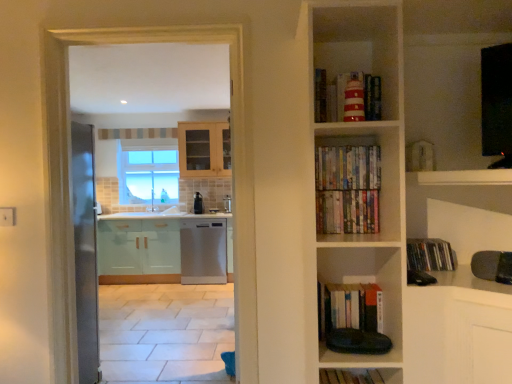
Question: From a real-world perspective, is clear glass window at center physically below striped paper lighthouse at upper center, which is the 6th book in bottom-to-top order?

Choices:
 (A) no
 (B) yes

Answer: (B)

Question: Does clear glass window at center have a lesser width compared to striped paper lighthouse at upper center, the first book when ordered from top to bottom?

Choices:
 (A) no
 (B) yes

Answer: (A)

Question: Does clear glass window at center have a larger size compared to striped paper lighthouse at upper center, which is the 6th book in bottom-to-top order?

Choices:
 (A) yes
 (B) no

Answer: (A)

Question: From the image's perspective, would you say clear glass window at center is shown under striped paper lighthouse at upper center, the first book when ordered from top to bottom?

Choices:
 (A) yes
 (B) no

Answer: (A)

Question: Can you confirm if clear glass window at center is shorter than striped paper lighthouse at upper center, the first book when ordered from top to bottom?

Choices:
 (A) no
 (B) yes

Answer: (A)

Question: From the image's perspective, is clear glass window at center above striped paper lighthouse at upper center, the first book when ordered from top to bottom?

Choices:
 (A) no
 (B) yes

Answer: (A)

Question: Is satin black dishwasher at center at the left side of wooden book at lower center, which ranks as the first book in bottom-to-top order?

Choices:
 (A) no
 (B) yes

Answer: (B)

Question: From the image's perspective, is satin black dishwasher at center above wooden book at lower center, which ranks as the first book in bottom-to-top order?

Choices:
 (A) no
 (B) yes

Answer: (B)

Question: Can you confirm if satin black dishwasher at center is wider than wooden book at lower center, which is the sixth book in top-to-bottom order?

Choices:
 (A) yes
 (B) no

Answer: (B)

Question: Could you tell me if satin black dishwasher at center is facing wooden book at lower center, which is the sixth book in top-to-bottom order?

Choices:
 (A) no
 (B) yes

Answer: (A)

Question: Are satin black dishwasher at center and wooden book at lower center, which ranks as the first book in bottom-to-top order, located far from each other?

Choices:
 (A) yes
 (B) no

Answer: (A)

Question: From a real-world perspective, is satin black dishwasher at center beneath wooden book at lower center, which ranks as the first book in bottom-to-top order?

Choices:
 (A) yes
 (B) no

Answer: (B)

Question: Is satin black dishwasher at center facing towards multicolored paperbacks at center, marked as the 5th book in a bottom-to-top arrangement?

Choices:
 (A) yes
 (B) no

Answer: (B)